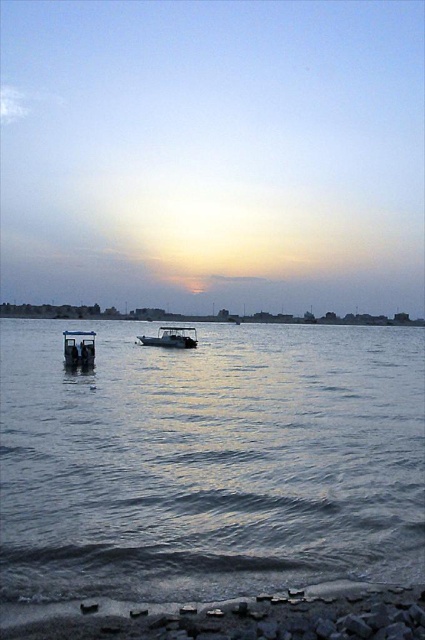
You are standing at the point marked by the coordinates point (232, 616) in the image. Based on the scene description, what type of terrain are you currently standing on?

The point (232, 616) marks smooth sand beach at lower center, so you are standing on a smooth sand beach.

You are standing at the shore looking at two points in the water. The first point is at coordinates point (87, 364) and the second point is at point (169, 330). Which point is closer to you?

Point (87, 364) is closer to the viewer than point (169, 330).

You are planning to set up a small tent for a beach picnic. The smooth sand beach at lower center and the metallic gray boat at left are both potential locations. Based on the scene description, which location has a wider area for setting up the tent?

The smooth sand beach at lower center is wider than the metallic gray boat at left, so it would provide a more spacious area for setting up the tent.